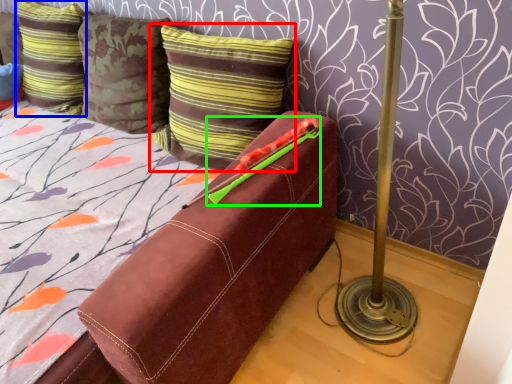
Question: Which object is the closest to the pillow (highlighted by a red box)? Choose among these: pillow (highlighted by a blue box) or crayon (highlighted by a green box).

Choices:
 (A) pillow
 (B) crayon

Answer: (B)